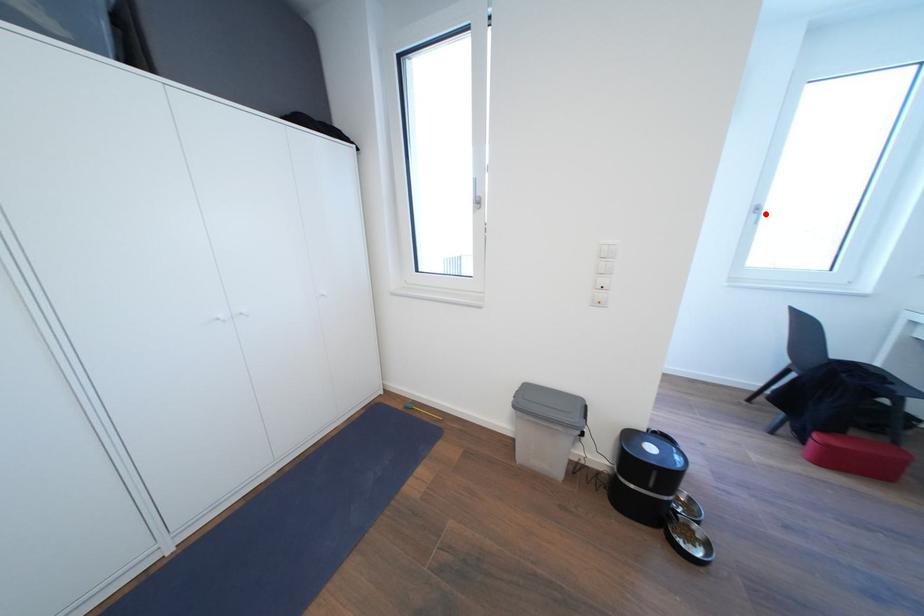
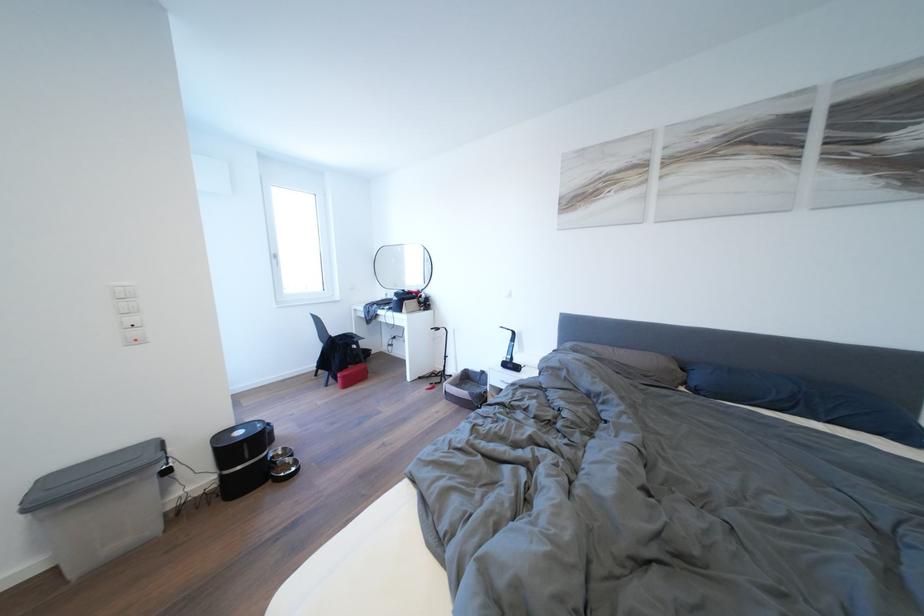
Question: I am providing you with two images of the same scene from different viewpoints. A red point is shown in image1. For the corresponding object point in image2, is it positioned nearer or farther from the camera?

Choices:
 (A) Nearer
 (B) Farther

Answer: (A)